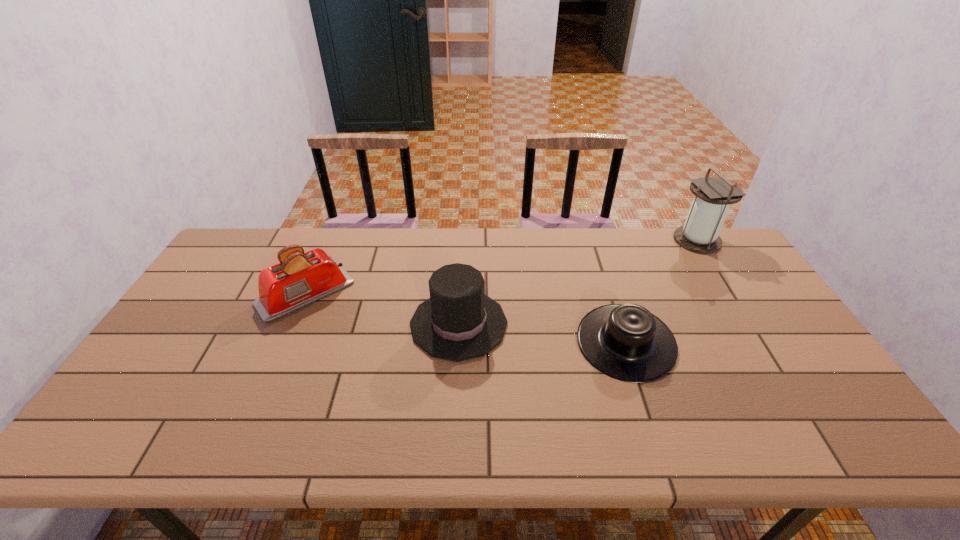
I want to click on vacant region between the left dress hat and the shorter dress hat, so click(542, 333).

Where is `free space between the second object from right to left and the left dress hat`? The image size is (960, 540). free space between the second object from right to left and the left dress hat is located at coordinates (542, 333).

The image size is (960, 540). Identify the location of vacant point located between the shorter dress hat and the third object from right to left. (542, 333).

Where is `free space between the toaster and the taller dress hat`? free space between the toaster and the taller dress hat is located at coordinates (382, 309).

Identify the location of vacant space that is in between the toaster and the taller dress hat. (382, 309).

Where is `free space between the right dress hat and the taller dress hat`? free space between the right dress hat and the taller dress hat is located at coordinates (542, 333).

What are the coordinates of `vacant space in between the right dress hat and the rightmost object` in the screenshot? It's located at 661,292.

Where is `the third closest object to the third object from right to left`? The height and width of the screenshot is (540, 960). the third closest object to the third object from right to left is located at coordinates (700, 234).

Locate an element on the screen. This screenshot has width=960, height=540. the closest object to the toaster is located at coordinates (458, 322).

This screenshot has height=540, width=960. I want to click on free space that satisfies the following two spatial constraints: 1. on the front of the taller dress hat with the decoration; 2. on the back side of the right dress hat, so click(458, 343).